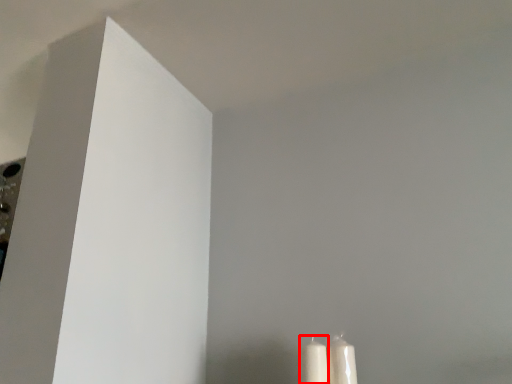
Question: Observing the image, what is the correct spatial positioning of candle (annotated by the red box) in reference to candle?

Choices:
 (A) left
 (B) right

Answer: (A)